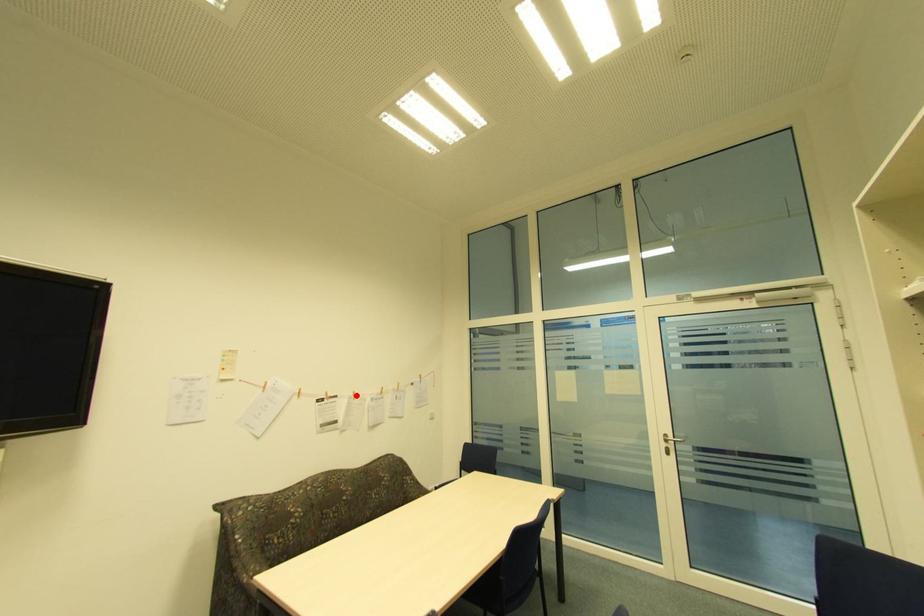
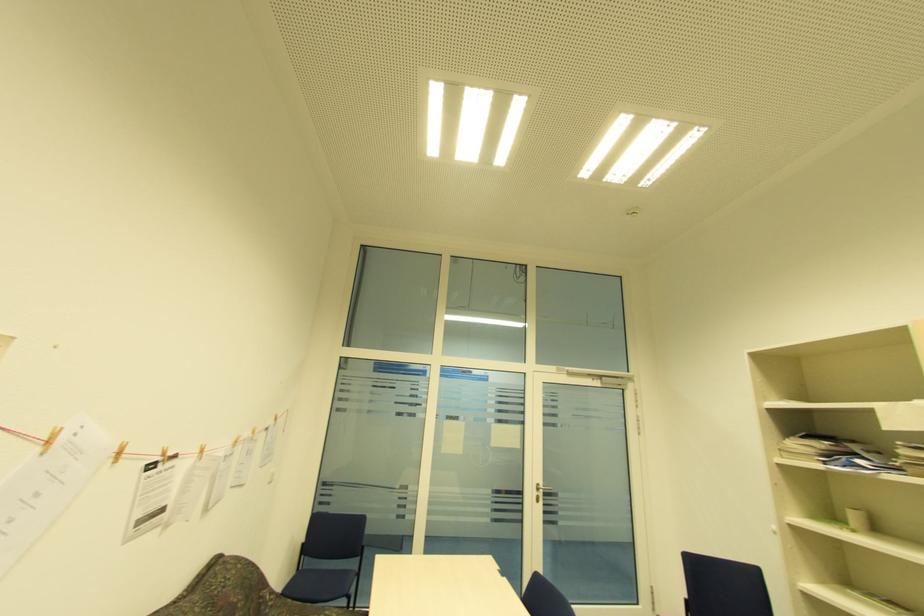
Locate, in the second image, the point that corresponds to the highlighted location in the first image.

(203, 453)